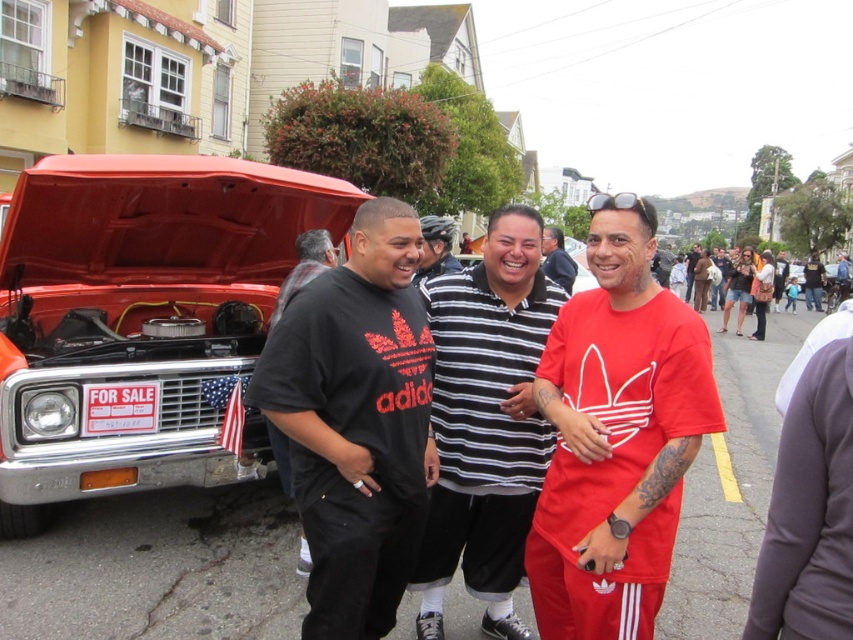
Looking at this image, you are a photographer trying to capture a photo of the shiny red car at left and the black matte adidas shirt at center. Based on their positions, which object is located to the right side of the other?

The black matte adidas shirt at center is located to the right of the shiny red car at left.

In the scene, there are three people wearing different shirts. The person on the left has a black Adidas tshirt, the middle person has a black and white striped polo shirt, and the person on the right has a bright red Adidas shirt. Can you tell me which of these shirts corresponds to the point located at coordinates (357, 420)?

The point at (357, 420) corresponds to the black matte adidas shirt at center.

You are a photographer standing at the camera position. You want to hand a camera to the person wearing the dark gray shirt at left. Can you reach them without moving from your current position? The average human arm length is 0.7 meters.

The dark gray shirt at left and camera are 4.15 meters apart from each other. Since the average human arm length is 0.7 meters, you cannot reach them without moving from your current position.